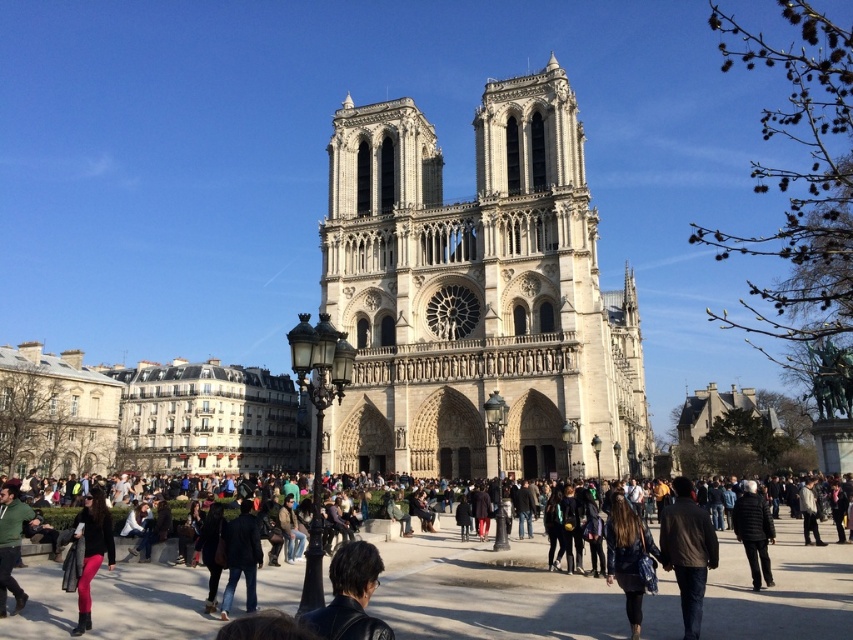
From the picture: You are standing at the point marked by point (x=350, y=596) in the image. What is the nearest object to you?

The nearest object to you is the leather jacket at center marked by point (x=350, y=596).

You are standing in the plaza in front of Notre Dame Cathedral and see two leather jackets. One is the dark brown leather jacket at lower left and the other is the leather jacket at center. Which one is closer to the cathedral?

The dark brown leather jacket at lower left is located below the leather jacket at center, so the dark brown leather jacket at lower left is closer to the cathedral.